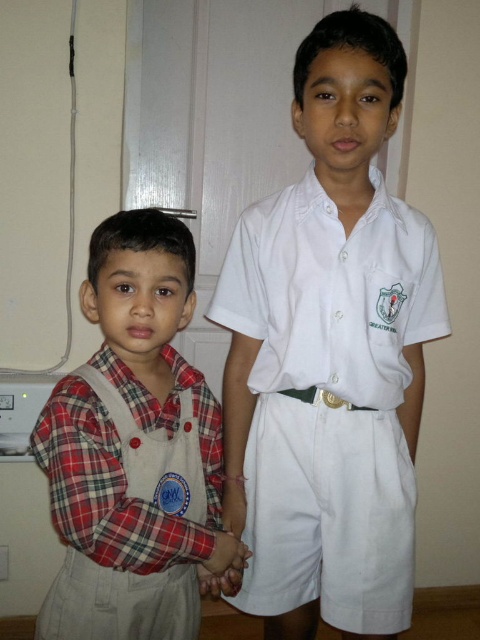
You are a tailor measuring shirts for a school uniform fitting. You have two shirts in front of you, the white cotton shirt at center and the plaid fabric shirt at left. Which shirt has a greater width according to the measurements?

The white cotton shirt at center has a greater width than the plaid fabric shirt at left according to the measurements provided.

You are a photographer setting up for a school photo. You need to position the two boys so that the white cotton shirt at center is to the right of the plaid fabric shirt at left. Based on their current positions in the image, do they already meet this requirement?

Yes, the white cotton shirt at center is already positioned to the right of the plaid fabric shirt at left as required.

You are a photographer setting up for a school event. You need to position two boys so that their shirts are visible. The white cotton shirt at center and the plaid fabric shirt at left must be arranged according to their current spatial relationship. Which shirt should be placed higher to ensure visibility?

The white cotton shirt at center should be placed higher than the plaid fabric shirt at left because the white cotton shirt at center is located above the plaid fabric shirt at left in the current setup.